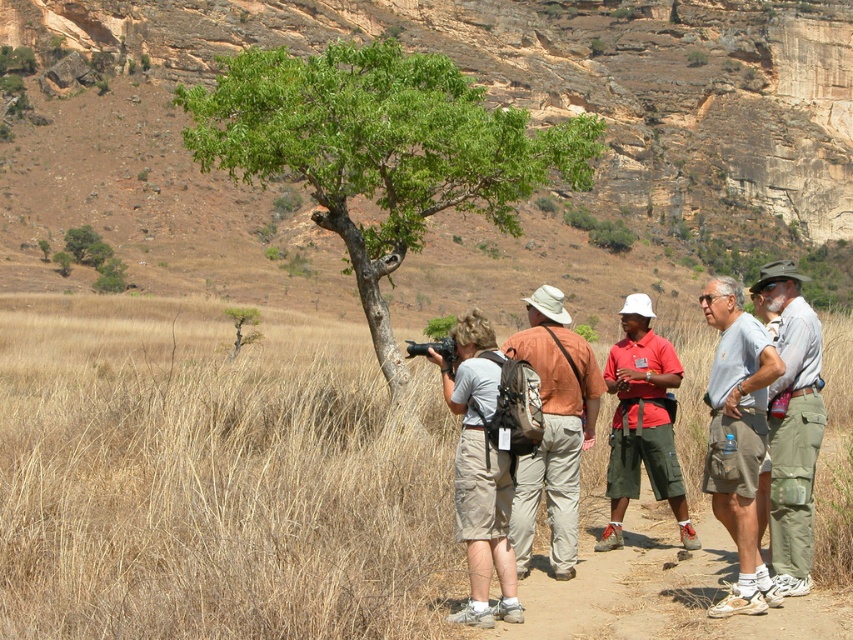
Between khaki cotton pants at right and red cotton shirt at center, which one appears on the left side from the viewer's perspective?

From the viewer's perspective, red cotton shirt at center appears more on the left side.

Does khaki cotton pants at right appear over red cotton shirt at center?

Correct, khaki cotton pants at right is located above red cotton shirt at center.

What do you see at coordinates (792, 426) in the screenshot? I see `khaki cotton pants at right` at bounding box center [792, 426].

Identify the location of khaki cotton pants at right. (792, 426).

Does dry grass at center have a greater height compared to khaki cotton pants at right?

Yes, dry grass at center is taller than khaki cotton pants at right.

Does dry grass at center appear on the right side of khaki cotton pants at right?

In fact, dry grass at center is to the left of khaki cotton pants at right.

Between point (38, 348) and point (810, 396), which one is positioned behind?

The point (38, 348) is behind.

Locate an element on the screen. dry grass at center is located at coordinates (213, 477).

Is dry grass at center to the right of gray fabric shirt at center-right from the viewer's perspective?

Incorrect, dry grass at center is not on the right side of gray fabric shirt at center-right.

Who is lower down, dry grass at center or gray fabric shirt at center-right?

gray fabric shirt at center-right is lower down.

Between point (115, 477) and point (740, 344), which one is positioned in front?

Point (740, 344)

Where is `dry grass at center`? dry grass at center is located at coordinates (213, 477).